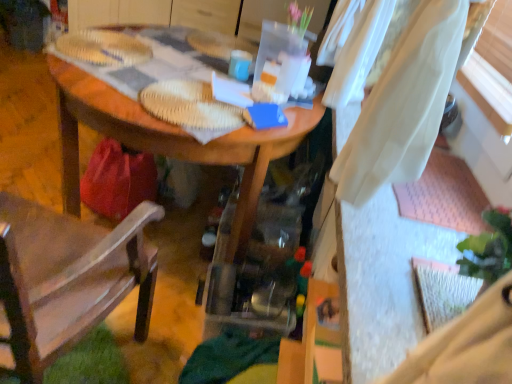
Question: Based on their positions, is brown fabric chair at left located to the left or right of wooden desk at center?

Choices:
 (A) right
 (B) left

Answer: (B)

Question: In terms of width, does brown fabric chair at left look wider or thinner when compared to wooden desk at center?

Choices:
 (A) wide
 (B) thin

Answer: (B)

Question: Which of these objects is positioned closest to the matte blue mug at center?

Choices:
 (A) wooden desk at center
 (B) brown fabric chair at left

Answer: (A)

Question: Based on their relative distances, which object is nearer to the matte blue mug at center?

Choices:
 (A) brown fabric chair at left
 (B) wooden desk at center

Answer: (B)